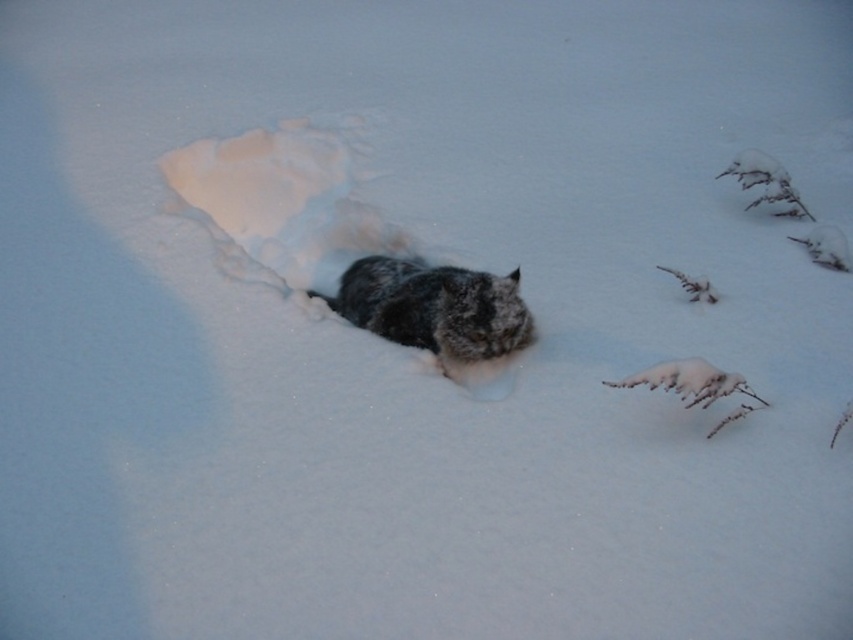
Can you confirm if white fluffy snow at center is positioned to the left of fuzzy fur cat at center?

Indeed, white fluffy snow at center is positioned on the left side of fuzzy fur cat at center.

Can you confirm if white fluffy snow at center is wider than fuzzy fur cat at center?

Correct, the width of white fluffy snow at center exceeds that of fuzzy fur cat at center.

Find the location of `white fluffy snow at center`. white fluffy snow at center is located at coordinates (286, 200).

At what (x,y) coordinates should I click in order to perform the action: click on white fluffy snow at center. Please return your answer as a coordinate pair (x, y). This screenshot has height=640, width=853. Looking at the image, I should click on (286, 200).